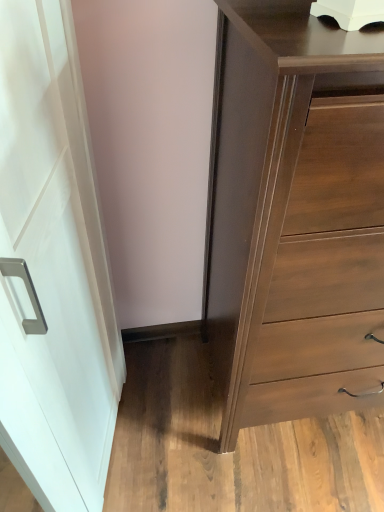
Where is `dark wood chest of drawers at center-right`? The image size is (384, 512). dark wood chest of drawers at center-right is located at coordinates (298, 217).

Describe the element at coordinates (298, 217) in the screenshot. I see `dark wood chest of drawers at center-right` at that location.

The image size is (384, 512). Find the location of `dark wood chest of drawers at center-right`. dark wood chest of drawers at center-right is located at coordinates (298, 217).